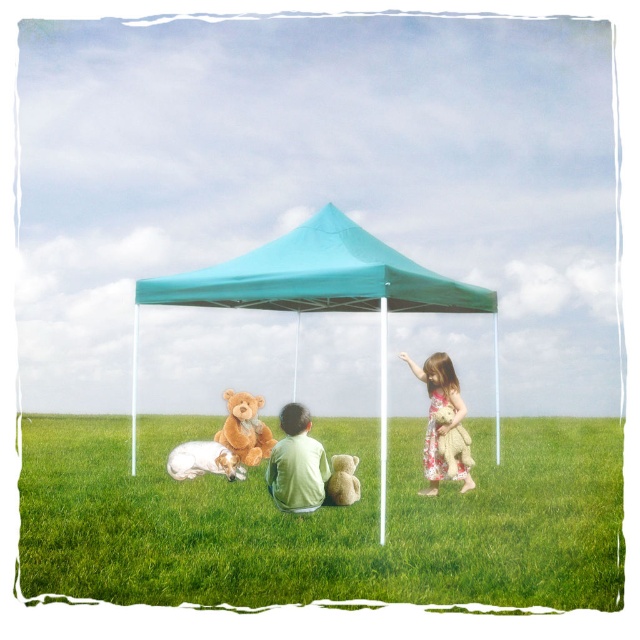
You are a photographer trying to capture a closeup shot of both the floral dress at right and the fuzzy beige teddy bear at lower right. Given that your camera can only focus on objects within an 8 inch range, will you be able to get both in focus at the same time?

The floral dress at right and fuzzy beige teddy bear at lower right are 7.34 inches apart from each other, so yes, both can be in focus since the distance between them is within the camera focus range of 8 inches.

You are a small robot with a height of 1.5 meters. You want to place a 2.5 meter long ladder between the soft green grass at center and the fuzzy beige teddy bear at lower center. Can you fit the ladder horizontally between them without it overlapping either object?

The distance between the soft green grass at center and the fuzzy beige teddy bear at lower center is 3.25 meters. Since the ladder is 2.5 meters long, it can fit horizontally between them as 2.5 meters is less than 3.25 meters.